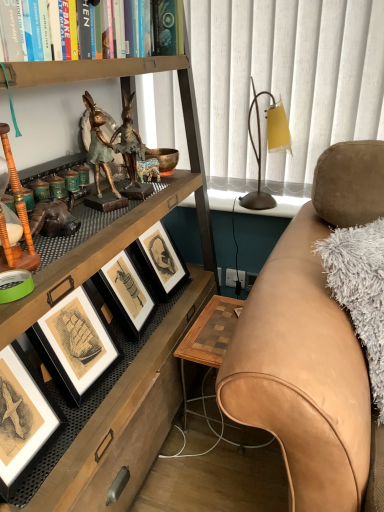
Question: From the image's perspective, does bronze statue at upper left appear lower than wooden checkered table at lower right?

Choices:
 (A) no
 (B) yes

Answer: (A)

Question: From a real-world perspective, is bronze statue at upper left under wooden checkered table at lower right?

Choices:
 (A) no
 (B) yes

Answer: (A)

Question: Does bronze statue at upper left lie behind wooden checkered table at lower right?

Choices:
 (A) no
 (B) yes

Answer: (A)

Question: Is bronze statue at upper left smaller than wooden checkered table at lower right?

Choices:
 (A) no
 (B) yes

Answer: (B)

Question: Is bronze statue at upper left in front of wooden checkered table at lower right?

Choices:
 (A) yes
 (B) no

Answer: (A)

Question: Is bronze statue at upper left shorter than wooden checkered table at lower right?

Choices:
 (A) no
 (B) yes

Answer: (B)

Question: Is tan leather couch at right to the left of bronze statue at upper left from the viewer's perspective?

Choices:
 (A) no
 (B) yes

Answer: (A)

Question: Is the surface of tan leather couch at right in direct contact with bronze statue at upper left?

Choices:
 (A) yes
 (B) no

Answer: (B)

Question: Can you confirm if tan leather couch at right is wider than bronze statue at upper left?

Choices:
 (A) no
 (B) yes

Answer: (B)

Question: Is tan leather couch at right in front of bronze statue at upper left?

Choices:
 (A) yes
 (B) no

Answer: (A)

Question: From a real-world perspective, is tan leather couch at right positioned under bronze statue at upper left based on gravity?

Choices:
 (A) yes
 (B) no

Answer: (A)

Question: Is tan leather couch at right shorter than bronze statue at upper left?

Choices:
 (A) yes
 (B) no

Answer: (B)

Question: Is matte black picture frame at lower left bigger than wooden checkered table at lower right?

Choices:
 (A) no
 (B) yes

Answer: (A)